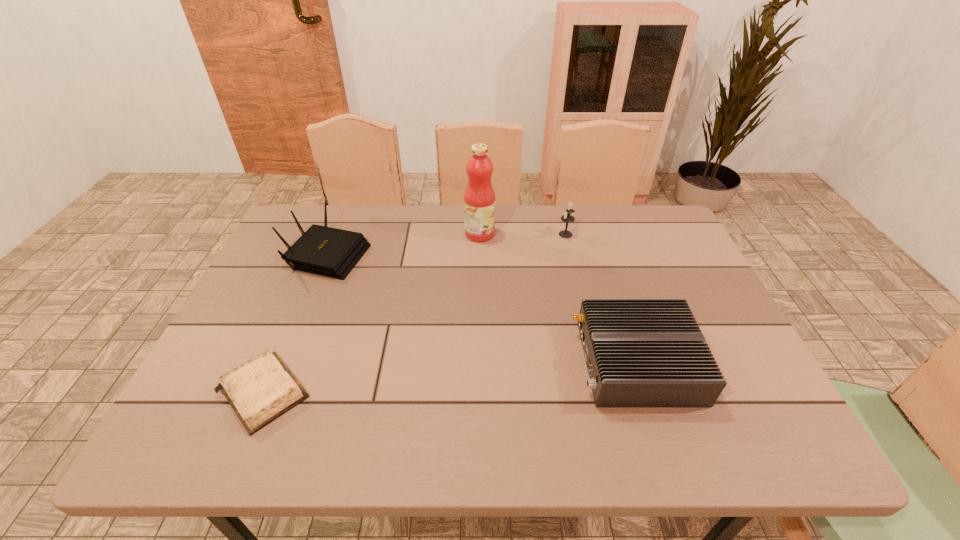
What are the coordinates of `free space between the candle holder and the left router` in the screenshot? It's located at (446, 243).

The image size is (960, 540). I want to click on vacant space that is in between the second shortest object and the fruit juice, so click(x=559, y=298).

The image size is (960, 540). I want to click on free space between the farther router and the fruit juice, so click(x=403, y=243).

Find the location of a particular element. The height and width of the screenshot is (540, 960). unoccupied area between the shortest object and the candle holder is located at coordinates (415, 313).

At what (x,y) coordinates should I click in order to perform the action: click on free space between the diary and the candle holder. Please return your answer as a coordinate pair (x, y). This screenshot has width=960, height=540. Looking at the image, I should click on (415, 313).

You are a GUI agent. You are given a task and a screenshot of the screen. Output one action in this format:
    pyautogui.click(x=<x>, y=<y>)
    Task: Click on the empty location between the diary and the right router
    This screenshot has height=540, width=960.
    Given the screenshot: What is the action you would take?
    pyautogui.click(x=450, y=377)

Find the location of a particular element. The width and height of the screenshot is (960, 540). object that can be found as the closest to the nearer router is located at coordinates (567, 218).

Select which object is the fourth closest to the shortest object. Please provide its 2D coordinates. Your answer should be formatted as a tuple, i.e. [(x, y)], where the tuple contains the x and y coordinates of a point satisfying the conditions above.

[(567, 218)]

The height and width of the screenshot is (540, 960). I want to click on vacant space that satisfies the following two spatial constraints: 1. on the front label of the candle holder; 2. on the right side of the third object from right to left, so click(480, 234).

Identify the location of blank area in the image that satisfies the following two spatial constraints: 1. on the front label of the fruit juice; 2. on the left side of the candle holder. This screenshot has width=960, height=540. (480, 234).